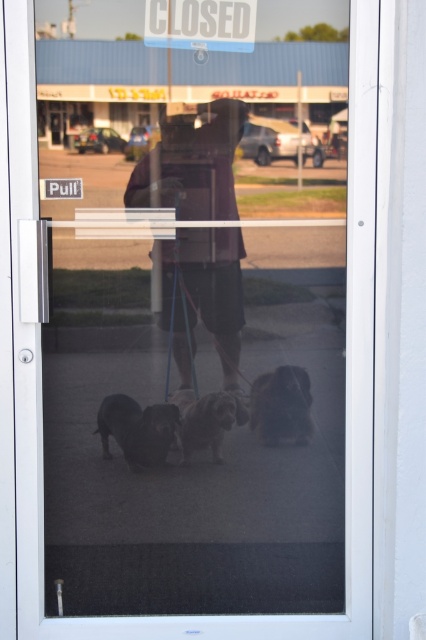
You are standing in front of the glass door with the CLOSED sign. You see two points marked on the door. The first point is at coordinates point (164, 36) and the second is at point (183, 424). If you want to touch the point that is closer to you, which coordinate should you choose?

Point (164, 36) is in front of point (183, 424), so you should choose point (164, 36) to touch the one closer to you.